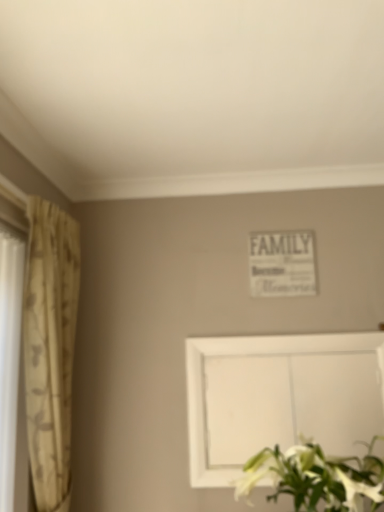
Question: Can you confirm if white matte picture frame at lower center is bigger than white matte floral arrangement at lower right?

Choices:
 (A) no
 (B) yes

Answer: (A)

Question: Would you say white matte picture frame at lower center is outside white matte floral arrangement at lower right?

Choices:
 (A) yes
 (B) no

Answer: (A)

Question: Is white matte picture frame at lower center far away from white matte floral arrangement at lower right?

Choices:
 (A) yes
 (B) no

Answer: (B)

Question: Can you see white matte picture frame at lower center touching white matte floral arrangement at lower right?

Choices:
 (A) no
 (B) yes

Answer: (A)

Question: From the image's perspective, is white matte picture frame at lower center beneath white matte floral arrangement at lower right?

Choices:
 (A) no
 (B) yes

Answer: (A)

Question: Is white matte picture frame at lower center facing away from white matte floral arrangement at lower right?

Choices:
 (A) yes
 (B) no

Answer: (B)

Question: Considering the relative sizes of beige floral fabric curtain at left and white matte floral arrangement at lower right in the image provided, is beige floral fabric curtain at left thinner than white matte floral arrangement at lower right?

Choices:
 (A) no
 (B) yes

Answer: (B)

Question: Can you confirm if beige floral fabric curtain at left is wider than white matte floral arrangement at lower right?

Choices:
 (A) no
 (B) yes

Answer: (A)

Question: From the image's perspective, is beige floral fabric curtain at left below white matte floral arrangement at lower right?

Choices:
 (A) no
 (B) yes

Answer: (A)

Question: Is beige floral fabric curtain at left bigger than white matte floral arrangement at lower right?

Choices:
 (A) no
 (B) yes

Answer: (A)

Question: Is beige floral fabric curtain at left facing towards white matte floral arrangement at lower right?

Choices:
 (A) no
 (B) yes

Answer: (B)

Question: Are beige floral fabric curtain at left and white matte floral arrangement at lower right located far from each other?

Choices:
 (A) no
 (B) yes

Answer: (A)

Question: Is white matte floral arrangement at lower right not near white matte picture frame at lower center?

Choices:
 (A) no
 (B) yes

Answer: (A)